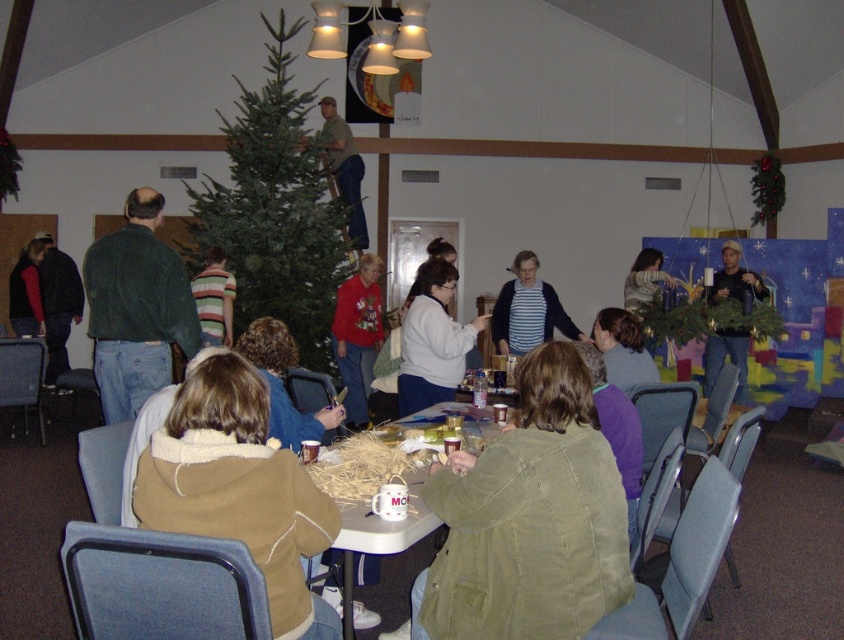
Please describe the position of the green matte christmas tree at center in terms of coordinates within the image frame. The image frame has a coordinate system where the bottom left corner is the origin point 0,0 and the top right corner is 1,1. The coordinates are given as a pair of numbers between 0 and 1, representing the horizontal and vertical positions respectively. The first number is the horizontal position from left to right, and the second number is the vertical position from bottom to top.

The green matte christmas tree at center is located at coordinates [276,209] within the image frame.

You are organizing a photo shoot and need to place a 2m wide backdrop behind the green matte christmas tree at center and the black fabric shirt at right. Which object requires the backdrop to be wider to accommodate its size?

The green matte christmas tree at center requires the backdrop to be wider because its width surpasses that of the black fabric shirt at right.

You are organizing a photo shoot and need to ensure that all participants are visible in the frame. Given that the striped cotton shirt at center and the camouflage fabric shirt at upper center are both important subjects, which of these two shirts should you focus on to ensure they are both in the frame without cropping?

The striped cotton shirt at center occupies less space than the camouflage fabric shirt at upper center, so focusing on the camouflage fabric shirt at upper center would ensure both are visible as it takes up more space and might require more framing consideration.